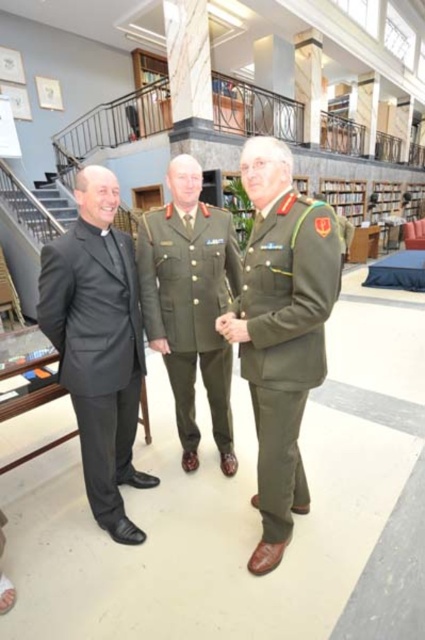
You are standing at the entrance of the library and want to approach the black matte suit at left. According to the scene description, where should you head to find it?

The black matte suit at left is located at point (98,344), so you should head towards the coordinates mentioned to find it.